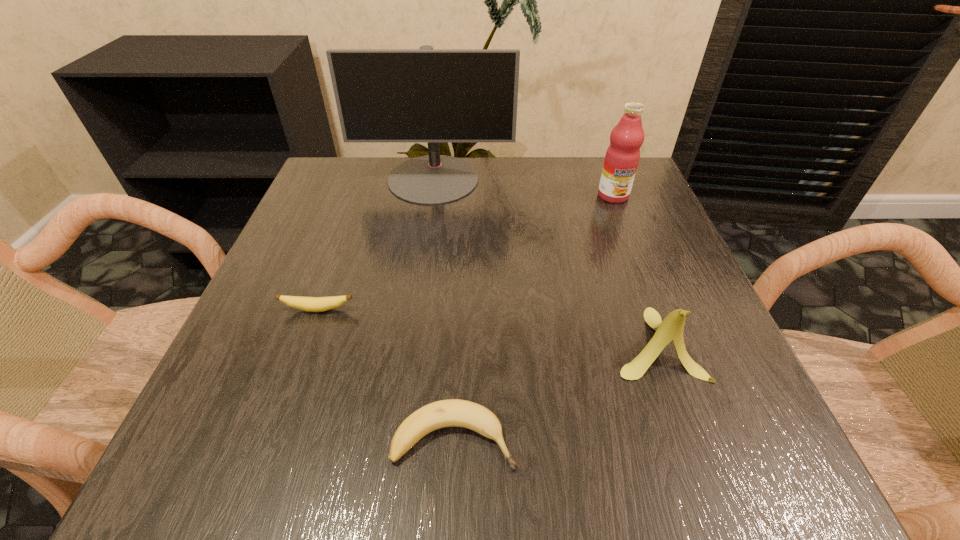
This screenshot has height=540, width=960. What are the coordinates of `vacant point located on the right of the leftmost banana` in the screenshot? It's located at (507, 309).

You are a GUI agent. You are given a task and a screenshot of the screen. Output one action in this format:
    pyautogui.click(x=<x>, y=<y>)
    Task: Click on the free space located at the stem of the nearest banana
    The image size is (960, 540).
    Given the screenshot: What is the action you would take?
    pyautogui.click(x=732, y=439)

Image resolution: width=960 pixels, height=540 pixels. Identify the location of computer monitor that is at the far edge. (429, 95).

Locate an element on the screen. fruit juice that is at the far edge is located at coordinates (622, 156).

You are a GUI agent. You are given a task and a screenshot of the screen. Output one action in this format:
    pyautogui.click(x=<x>, y=<y>)
    Task: Click on the object present at the near edge
    This screenshot has height=540, width=960.
    Given the screenshot: What is the action you would take?
    pyautogui.click(x=453, y=412)

You are a GUI agent. You are given a task and a screenshot of the screen. Output one action in this format:
    pyautogui.click(x=<x>, y=<y>)
    Task: Click on the computer monitor at the left edge
    
    Given the screenshot: What is the action you would take?
    pyautogui.click(x=429, y=95)

You are a GUI agent. You are given a task and a screenshot of the screen. Output one action in this format:
    pyautogui.click(x=<x>, y=<y>)
    Task: Click on the banana positioned at the left edge
    This screenshot has height=540, width=960.
    Given the screenshot: What is the action you would take?
    pyautogui.click(x=311, y=304)

Image resolution: width=960 pixels, height=540 pixels. I want to click on fruit juice present at the right edge, so click(x=622, y=156).

This screenshot has width=960, height=540. I want to click on banana present at the right edge, so click(x=671, y=328).

I want to click on object present at the far left corner, so click(x=429, y=95).